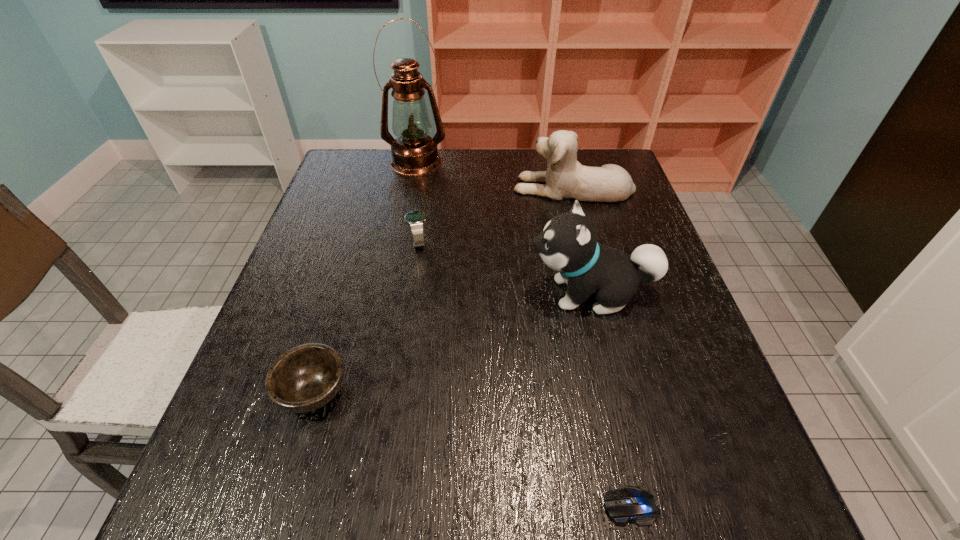
This screenshot has height=540, width=960. In order to click on vacant space at the far edge of the desktop in this screenshot , I will do `click(460, 156)`.

The height and width of the screenshot is (540, 960). In order to click on vacant space at the near edge in this screenshot , I will do `click(530, 493)`.

Image resolution: width=960 pixels, height=540 pixels. In the image, there is a desktop. What are the coordinates of `vacant space at the left edge` in the screenshot? It's located at (269, 321).

The height and width of the screenshot is (540, 960). Find the location of `free space at the right edge`. free space at the right edge is located at coordinates pyautogui.click(x=652, y=452).

Where is `blank space at the far left corner of the desktop`? This screenshot has width=960, height=540. blank space at the far left corner of the desktop is located at coordinates (354, 185).

Find the location of a particular element. The width and height of the screenshot is (960, 540). vacant space that is in between the fifth shortest object and the fourth tallest object is located at coordinates (505, 268).

At what (x,y) coordinates should I click in order to perform the action: click on unoccupied position between the nearer puppy and the third shortest object. Please return your answer as a coordinate pair (x, y). The width and height of the screenshot is (960, 540). Looking at the image, I should click on (505, 268).

Identify the location of free space between the second shortest object and the shorter puppy. The height and width of the screenshot is (540, 960). (444, 289).

Image resolution: width=960 pixels, height=540 pixels. I want to click on vacant region between the second nearest object and the nearer puppy, so click(452, 342).

Image resolution: width=960 pixels, height=540 pixels. I want to click on free space between the nearest object and the fourth tallest object, so (x=525, y=374).